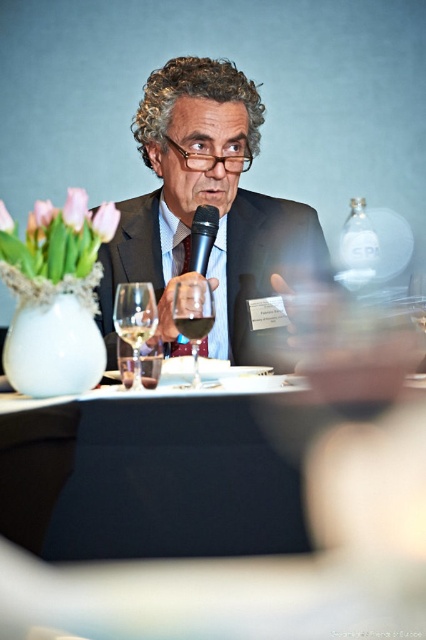
You are a photographer positioned at point [207,204]. You need to capture a photo of the matte black suit at center. Which direction should you move to get a clear shot?

The photographer should move directly towards the matte black suit at center since they are already positioned at the point where it is located.

You are standing in the conference room and want to approach the speaker. The point marked at coordinates (207, 204) indicates the location of the speaker. Can you determine if the speaker is wearing a dark suit?

Yes, the speaker is wearing a matte black suit at center as indicated by the point at coordinates (207, 204).

You are attending a conference and need to locate the speaker who is wearing a matte black suit at center. From your perspective, which side of the black matte microphone at center should you look towards to find him?

The matte black suit at center is to the right of the black matte microphone at center, so you should look to the right side of the microphone to find him.